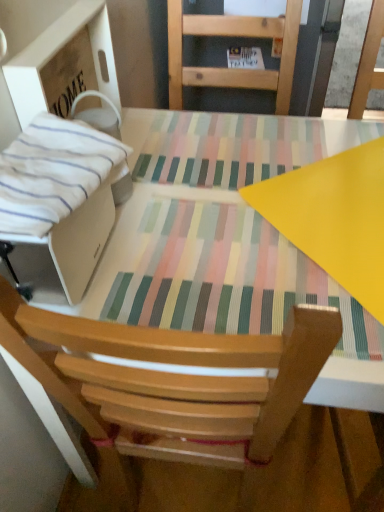
Question: From a real-world perspective, is white cardboard box at left physically located above or below matte plastic table at center?

Choices:
 (A) below
 (B) above

Answer: (B)

Question: Is white cardboard box at left inside or outside of matte plastic table at center?

Choices:
 (A) outside
 (B) inside

Answer: (A)

Question: Which object is positioned farthest from the white cardboard box at left?

Choices:
 (A) matte plastic table at center
 (B) white striped fabric at left

Answer: (A)

Question: Estimate the real-world distances between objects in this image. Which object is closer to the white striped fabric at left?

Choices:
 (A) matte plastic table at center
 (B) white cardboard box at left

Answer: (B)